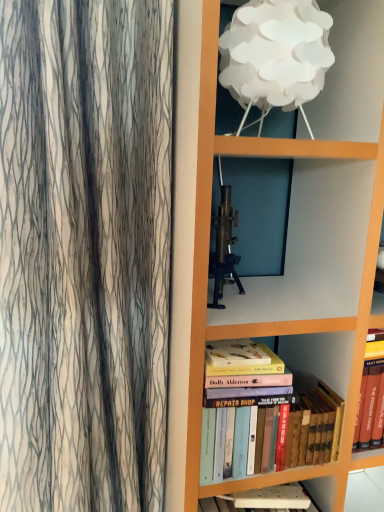
At what (x,y) coordinates should I click in order to perform the action: click on hardcover books at center. Please return your answer as a coordinate pair (x, y). This screenshot has height=512, width=384. Looking at the image, I should click on (267, 431).

Describe the element at coordinates (267, 431) in the screenshot. This screenshot has height=512, width=384. I see `hardcover books at center` at that location.

What is the approximate width of hardcover books at center?

hardcover books at center is 6.59 inches wide.

This screenshot has width=384, height=512. What are the coordinates of `hardcover books at center` in the screenshot? It's located at (267, 431).